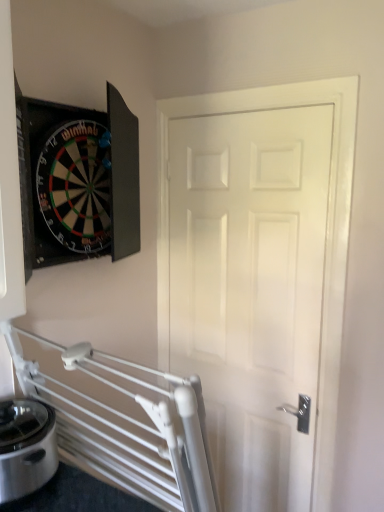
Question: Is white glossy door at center inside satin silver appliance at lower left?

Choices:
 (A) yes
 (B) no

Answer: (B)

Question: Would you say satin silver appliance at lower left is a long distance from white glossy door at center?

Choices:
 (A) yes
 (B) no

Answer: (B)

Question: From a real-world perspective, is satin silver appliance at lower left located beneath white glossy door at center?

Choices:
 (A) no
 (B) yes

Answer: (B)

Question: Does satin silver appliance at lower left have a larger size compared to white glossy door at center?

Choices:
 (A) no
 (B) yes

Answer: (A)

Question: Can you confirm if satin silver appliance at lower left is shorter than white glossy door at center?

Choices:
 (A) yes
 (B) no

Answer: (A)

Question: Considering the relative positions of satin silver appliance at lower left and white glossy door at center in the image provided, is satin silver appliance at lower left to the right of white glossy door at center from the viewer's perspective?

Choices:
 (A) no
 (B) yes

Answer: (A)

Question: Is white glossy door at center closer to camera compared to satin silver appliance at lower left?

Choices:
 (A) yes
 (B) no

Answer: (B)

Question: Considering the relative positions of white glossy door at center and satin silver appliance at lower left in the image provided, is white glossy door at center behind satin silver appliance at lower left?

Choices:
 (A) yes
 (B) no

Answer: (A)

Question: Considering the relative sizes of white glossy door at center and satin silver appliance at lower left in the image provided, is white glossy door at center wider than satin silver appliance at lower left?

Choices:
 (A) no
 (B) yes

Answer: (A)

Question: Is white glossy door at center at the left side of satin silver appliance at lower left?

Choices:
 (A) no
 (B) yes

Answer: (A)

Question: Can we say white glossy door at center lies outside satin silver appliance at lower left?

Choices:
 (A) no
 (B) yes

Answer: (B)

Question: Is white glossy door at center facing away from satin silver appliance at lower left?

Choices:
 (A) yes
 (B) no

Answer: (B)

Question: Looking at the image, does white glossy door at center seem bigger or smaller compared to satin silver appliance at lower left?

Choices:
 (A) big
 (B) small

Answer: (A)